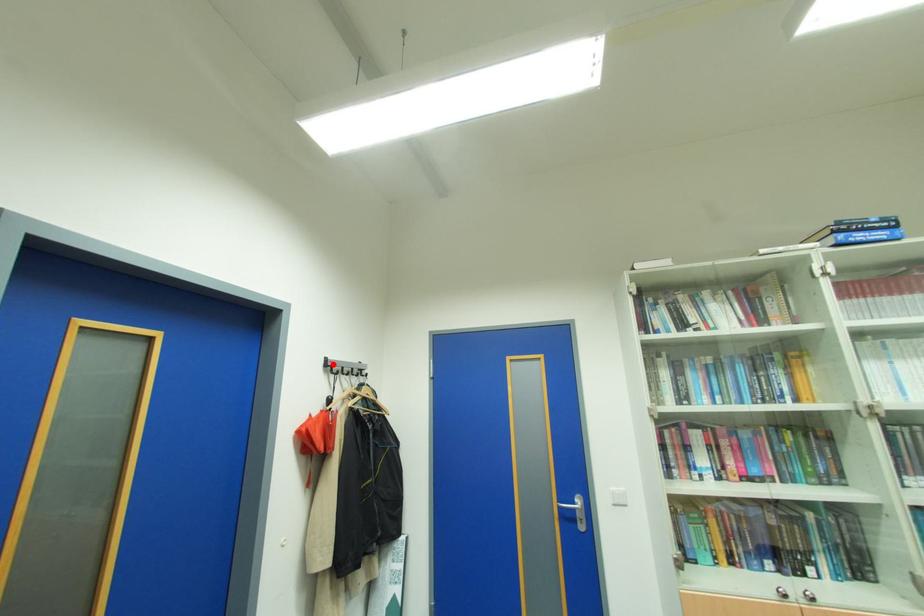
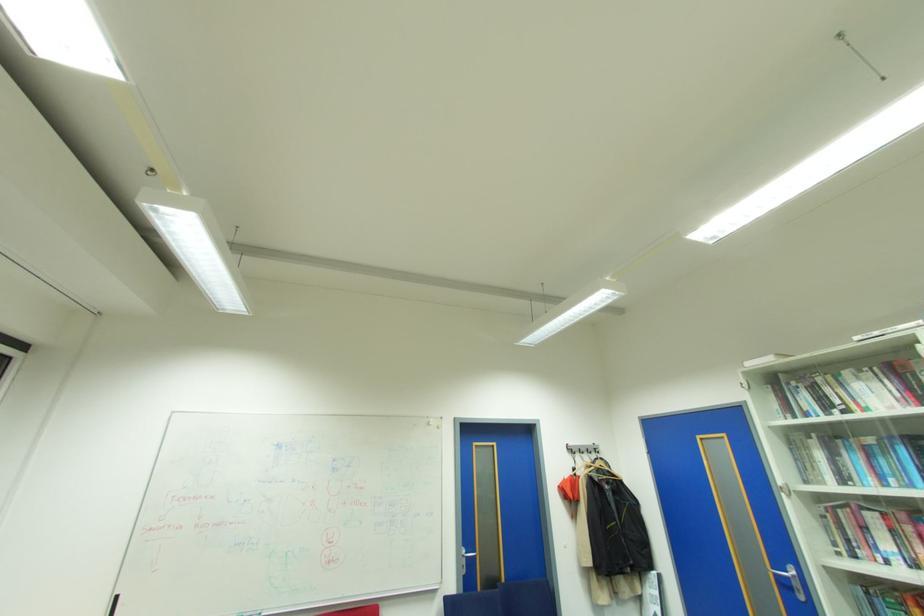
Question: I am providing you with two images of the same scene from different viewpoints. Given a red point in image1, look at the same physical point in image2. Is it:

Choices:
 (A) Closer to the viewpoint
 (B) Farther from the viewpoint

Answer: (B)